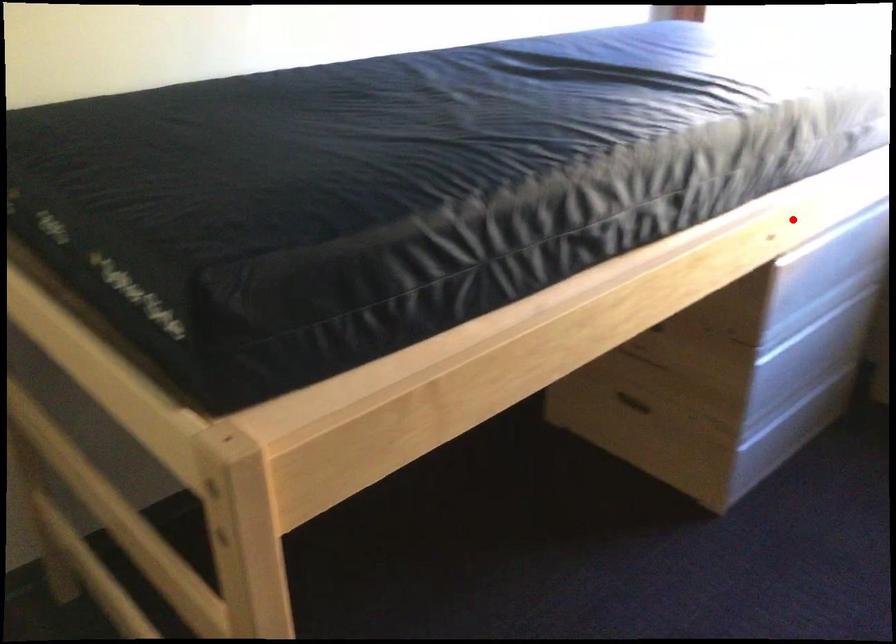
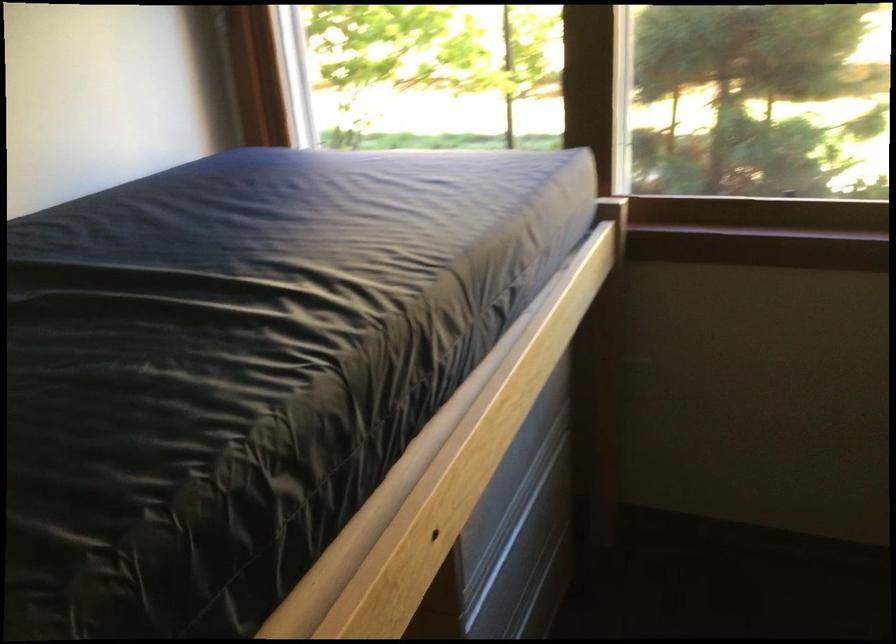
Where in the second image is the point corresponding to the highlighted location from the first image?

(467, 478)